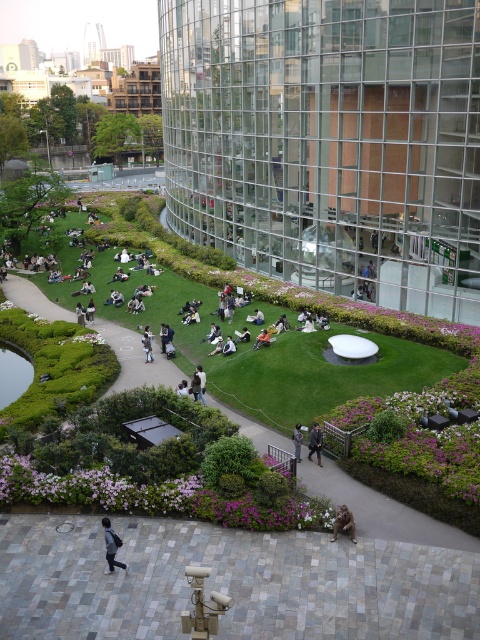
Who is shorter, green grassy park at center or dark gray fabric jacket at lower left?

With less height is dark gray fabric jacket at lower left.

Which is behind, point (400, 326) or point (118, 545)?

The point (400, 326) is behind.

Locate an element on the screen. green grassy park at center is located at coordinates tap(316, 301).

Find the location of a particular element. The height and width of the screenshot is (640, 480). green grassy park at center is located at coordinates (316, 301).

Who is more distant from viewer, (x=116, y=545) or (x=310, y=440)?

The point (x=310, y=440) is more distant.

From the picture: Is the position of dark gray fabric jacket at lower left more distant than that of dark gray sweater at center?

That is False.

Identify the location of dark gray fabric jacket at lower left. This screenshot has width=480, height=640. (111, 545).

Does brown fur monkey at lower center appear on the left side of gray fabric jacket at center?

No, brown fur monkey at lower center is not to the left of gray fabric jacket at center.

The image size is (480, 640). I want to click on brown fur monkey at lower center, so click(344, 522).

I want to click on brown fur monkey at lower center, so click(x=344, y=522).

Locate an element on the screen. The image size is (480, 640). brown fur monkey at lower center is located at coordinates (344, 522).